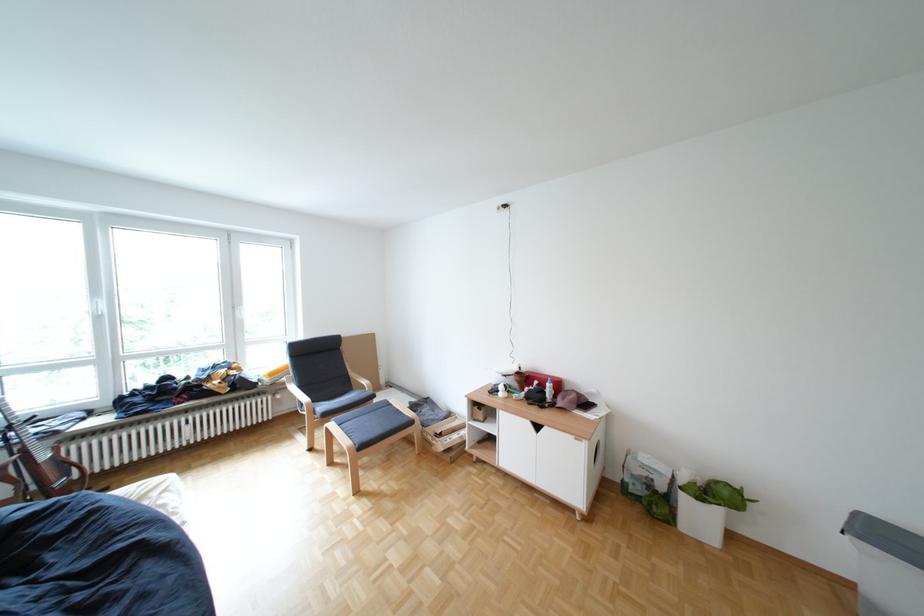
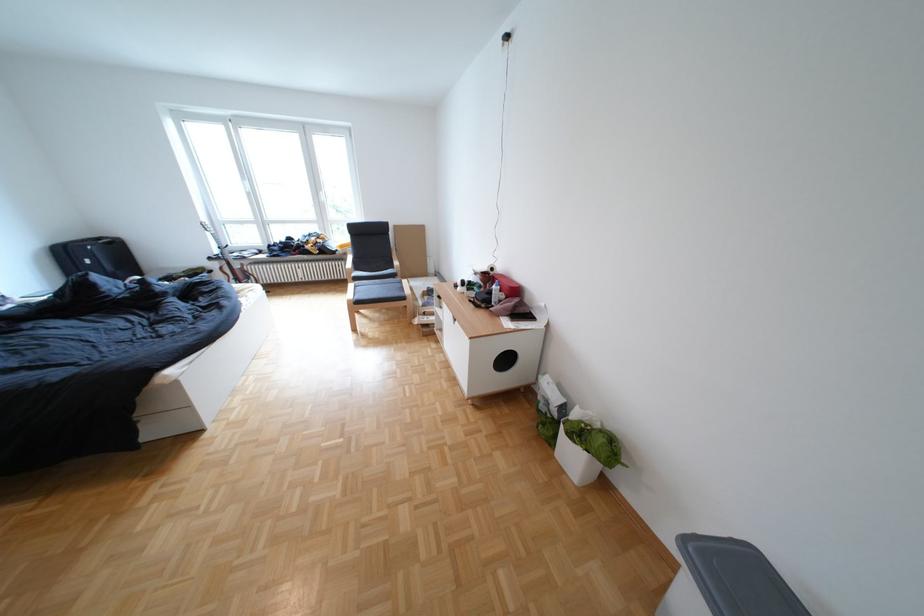
Where in the second image is the point corresponding to point 689,477 from the first image?

(579, 408)